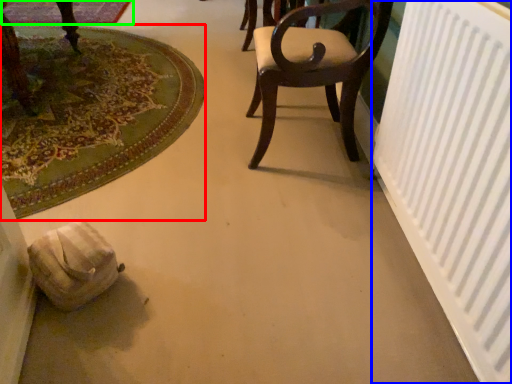
Question: Which is farther away from mat (highlighted by a red box)? radiator (highlighted by a blue box) or mat (highlighted by a green box)?

Choices:
 (A) radiator
 (B) mat

Answer: (A)